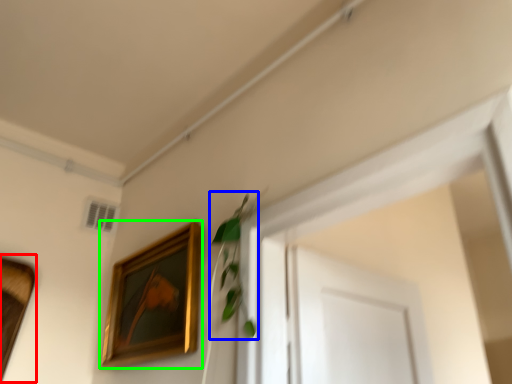
Question: Which is nearer to the picture frame (highlighted by a red box)? plant (highlighted by a blue box) or picture frame (highlighted by a green box).

Choices:
 (A) plant
 (B) picture frame

Answer: (B)